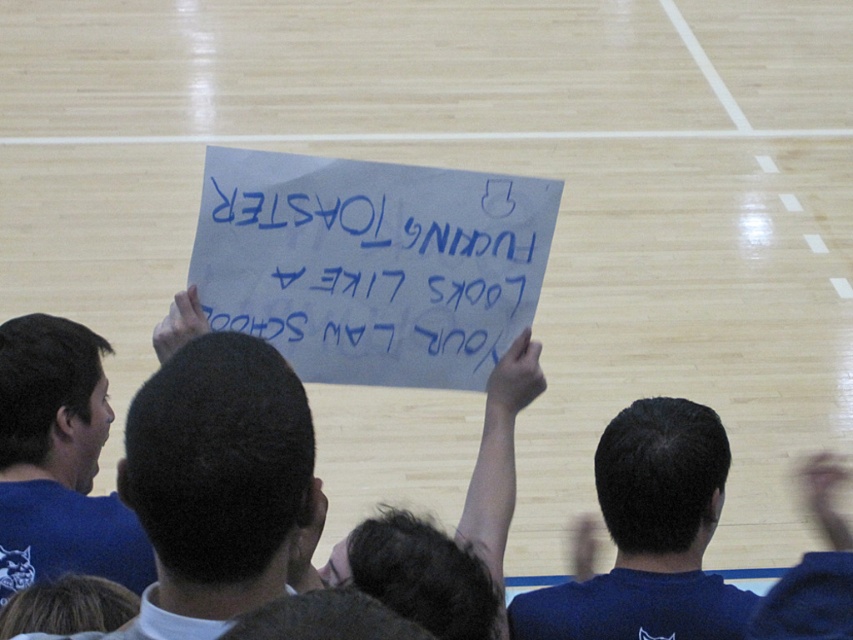
Does white paper sign at center appear on the right side of blue fabric shirt at upper center?

Correct, you'll find white paper sign at center to the right of blue fabric shirt at upper center.

Is point (357, 257) in front of point (173, 358)?

No, (357, 257) is further to viewer.

The image size is (853, 640). What are the coordinates of `white paper sign at center` in the screenshot? It's located at (373, 266).